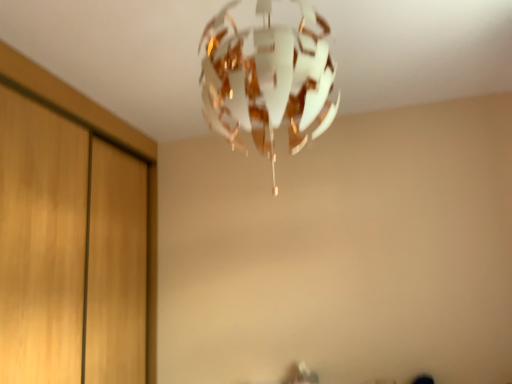
Question: In terms of height, does white paper lamp at upper center look taller or shorter compared to wooden dresser at left?

Choices:
 (A) tall
 (B) short

Answer: (B)

Question: In the image, is white paper lamp at upper center positioned in front of or behind wooden dresser at left?

Choices:
 (A) behind
 (B) front

Answer: (B)

Question: Is point (211, 100) closer or farther from the camera than point (154, 142)?

Choices:
 (A) closer
 (B) farther

Answer: (A)

Question: Is wooden dresser at left in front of or behind white paper lamp at upper center in the image?

Choices:
 (A) front
 (B) behind

Answer: (B)

Question: Considering the positions of wooden dresser at left and white paper lamp at upper center in the image, is wooden dresser at left wider or thinner than white paper lamp at upper center?

Choices:
 (A) thin
 (B) wide

Answer: (A)

Question: In terms of height, does wooden dresser at left look taller or shorter compared to white paper lamp at upper center?

Choices:
 (A) short
 (B) tall

Answer: (B)

Question: From the image's perspective, relative to white paper lamp at upper center, is wooden dresser at left above or below?

Choices:
 (A) below
 (B) above

Answer: (A)